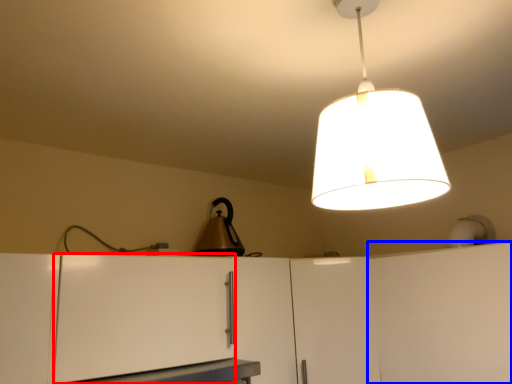
Question: Which object appears closest to the camera in this image, cabinetry (highlighted by a red box) or cabinetry (highlighted by a blue box)?

Choices:
 (A) cabinetry
 (B) cabinetry

Answer: (A)